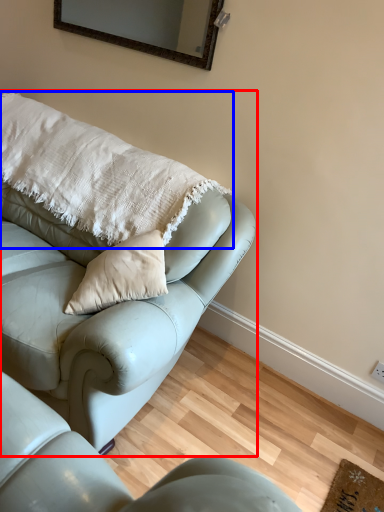
Question: Which of the following is the farthest to the observer, studio couch (highlighted by a red box) or pillow (highlighted by a blue box)?

Choices:
 (A) studio couch
 (B) pillow

Answer: (B)